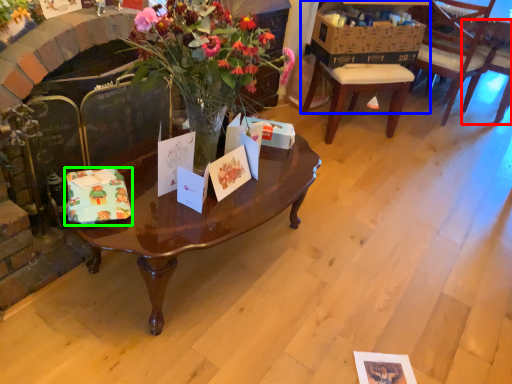
Question: Which object is the closest to the chair (highlighted by a red box)? Choose among these: desk (highlighted by a blue box) or gift card (highlighted by a green box).

Choices:
 (A) desk
 (B) gift card

Answer: (A)